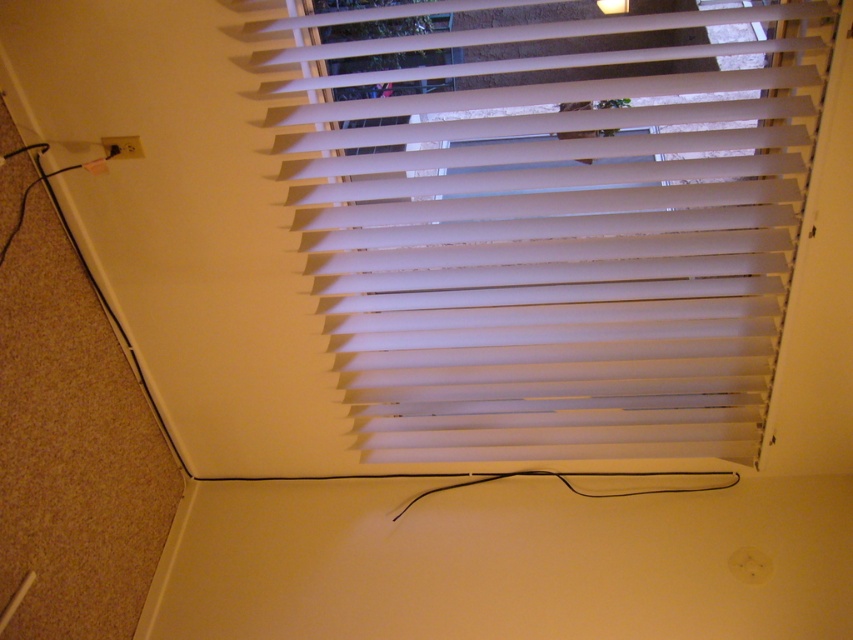
Which is in front, point (773, 259) or point (604, 12)?

Point (604, 12) is more forward.

In the scene shown: Between white matte blinds at upper center and white plastic lampshade at upper center, which one has more height?

white matte blinds at upper center is taller.

The image size is (853, 640). What are the coordinates of `white matte blinds at upper center` in the screenshot? It's located at (553, 224).

Find the location of a particular element. This screenshot has width=853, height=640. white matte blinds at upper center is located at coordinates (553, 224).

Who is positioned more to the left, black plastic plug at upper left or white plastic lampshade at upper center?

black plastic plug at upper left is more to the left.

Between point (111, 150) and point (602, 1), which one is positioned behind?

The point (111, 150) is behind.

Find the location of a particular element. This screenshot has width=853, height=640. black plastic plug at upper left is located at coordinates point(122,147).

Which is in front, point (685, 198) or point (134, 140)?

Positioned in front is point (685, 198).

Who is taller, white matte blinds at upper center or black plastic plug at upper left?

Standing taller between the two is white matte blinds at upper center.

Is point (659, 184) closer to viewer compared to point (132, 141)?

Yes, point (659, 184) is in front of point (132, 141).

Locate an element on the screen. This screenshot has width=853, height=640. white matte blinds at upper center is located at coordinates (553, 224).